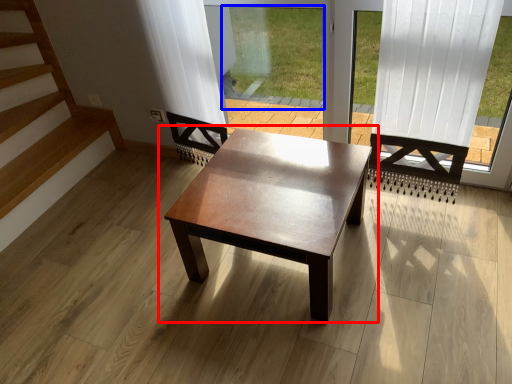
Question: Which object appears farthest to the camera in this image, coffee table (highlighted by a red box) or window screen (highlighted by a blue box)?

Choices:
 (A) coffee table
 (B) window screen

Answer: (B)